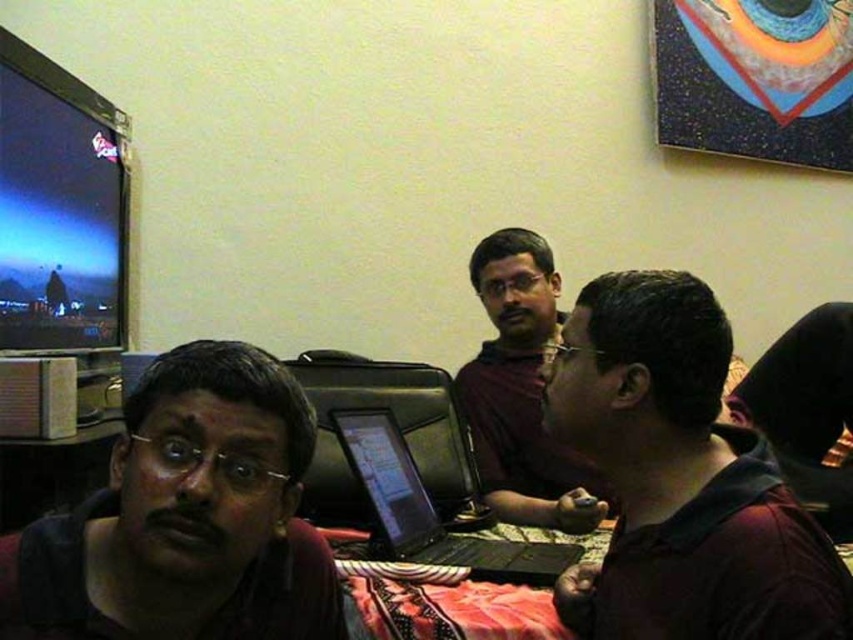
Between point (706, 433) and point (120, 540), which one is positioned in front?

Positioned in front is point (120, 540).

Which is more to the right, dark brown hair at center or matte black shirt at left?

dark brown hair at center

Find the location of `dark brown hair at center`. dark brown hair at center is located at coordinates (680, 480).

Who is taller, matte black shirt at left or black glossy laptop at center?

With more height is matte black shirt at left.

This screenshot has width=853, height=640. Identify the location of matte black shirt at left. (186, 516).

Which is behind, point (195, 419) or point (520, 570)?

Positioned behind is point (520, 570).

Find the location of a particular element. The image size is (853, 640). matte black shirt at left is located at coordinates (186, 516).

Does dark brown hair at center have a smaller size compared to black glossy laptop at center?

Actually, dark brown hair at center might be larger than black glossy laptop at center.

Between dark brown hair at center and black glossy laptop at center, which one has less height?

With less height is black glossy laptop at center.

Where is `dark brown hair at center`? The width and height of the screenshot is (853, 640). dark brown hair at center is located at coordinates (680, 480).